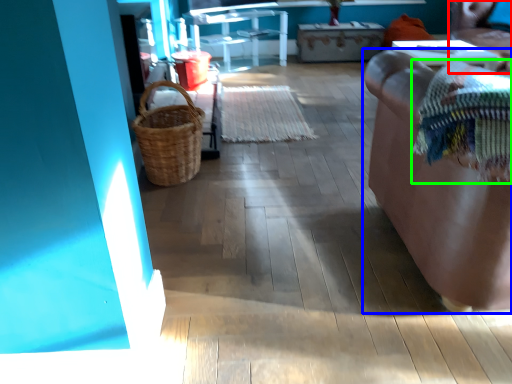
Question: Which object is the closest to the chair (highlighted by a red box)? Choose among these: furniture (highlighted by a blue box) or blanket (highlighted by a green box).

Choices:
 (A) furniture
 (B) blanket

Answer: (A)